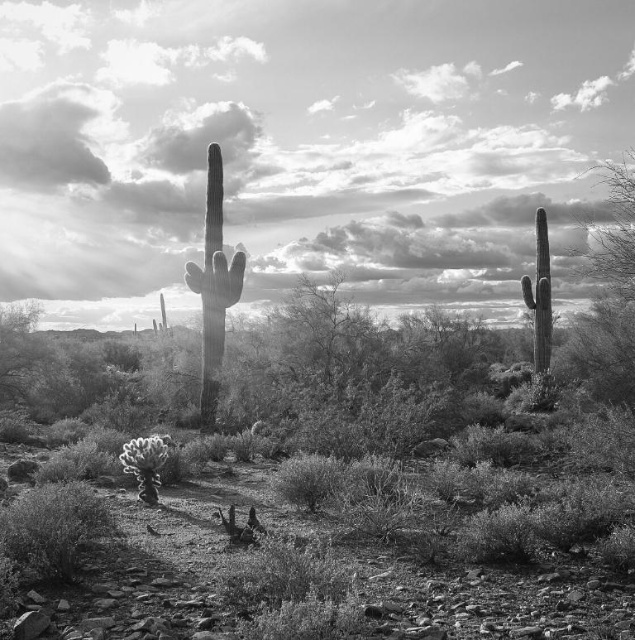
Question: Which object is farther from the camera taking this photo?

Choices:
 (A) cloudy sky at upper center
 (B) smooth green cactus at center

Answer: (B)

Question: Which object is the closest to the cloudy sky at upper center?

Choices:
 (A) smooth green cactus at center
 (B) smooth gray cactus at right

Answer: (B)

Question: Does cloudy sky at upper center lie in front of smooth gray cactus at right?

Choices:
 (A) no
 (B) yes

Answer: (B)

Question: Which object is the closest to the smooth gray cactus at right?

Choices:
 (A) cloudy sky at upper center
 (B) smooth green cactus at center

Answer: (B)

Question: Does smooth green cactus at center come behind smooth gray cactus at right?

Choices:
 (A) no
 (B) yes

Answer: (A)

Question: Is smooth green cactus at center further to camera compared to smooth gray cactus at right?

Choices:
 (A) no
 (B) yes

Answer: (A)